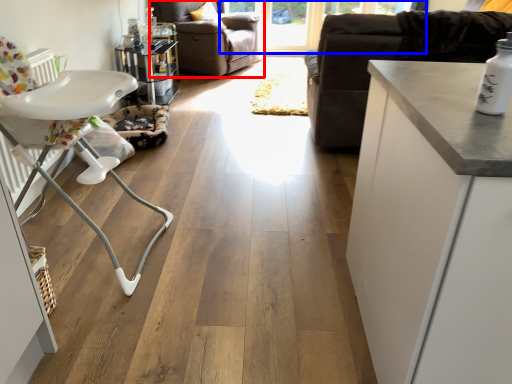
Question: Which of the following is the closest to the observer, chair (highlighted by a red box) or window screen (highlighted by a blue box)?

Choices:
 (A) chair
 (B) window screen

Answer: (A)